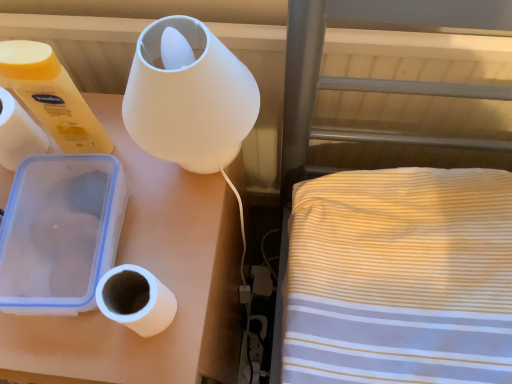
You are a GUI agent. You are given a task and a screenshot of the screen. Output one action in this format:
    pyautogui.click(x=<x>, y=<y>)
    Task: Click on the free space above white matte lamp at upper left (from a real-world perspective)
    The image size is (512, 384).
    Given the screenshot: What is the action you would take?
    pyautogui.click(x=125, y=211)